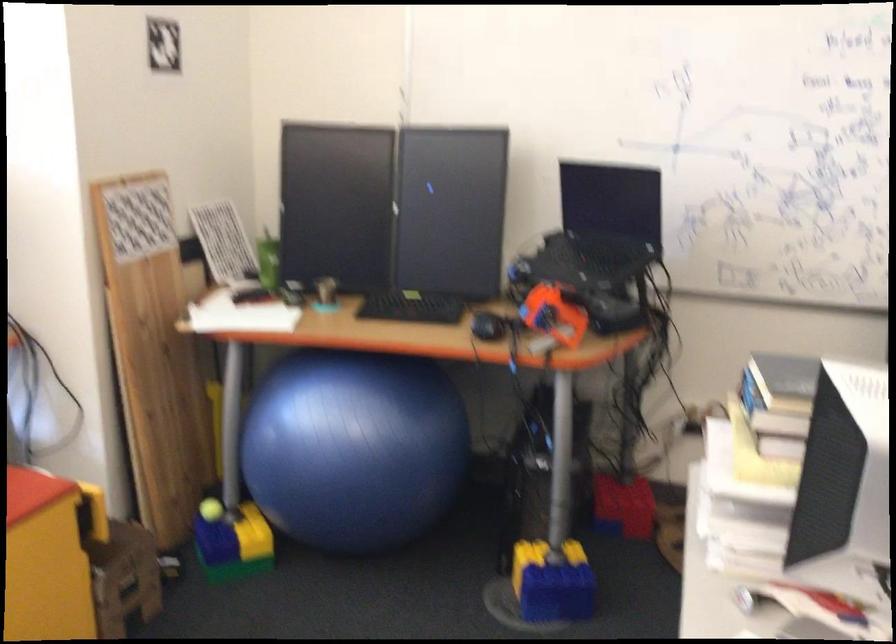
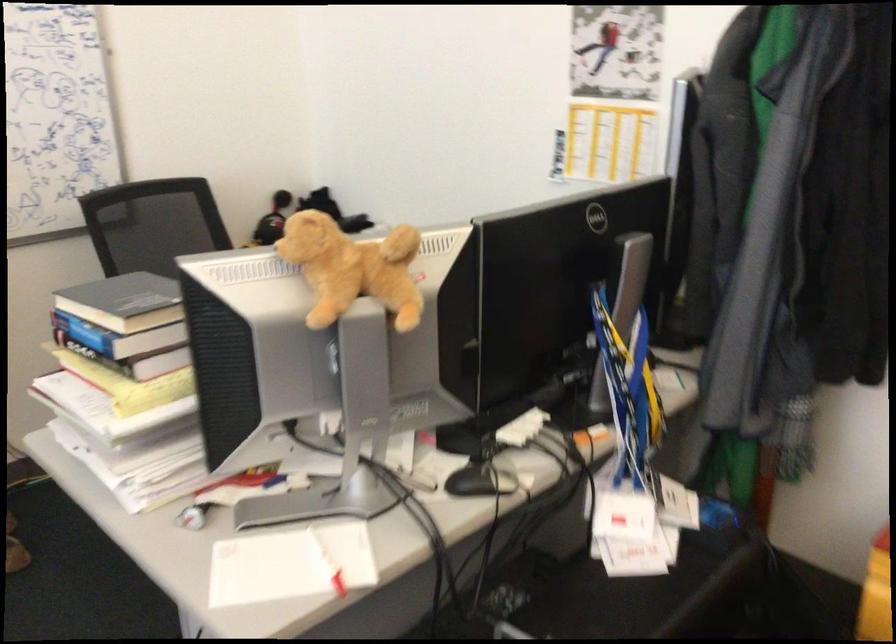
Question: The camera is either moving clockwise (left) or counter-clockwise (right) around the object. The first image is from the beginning of the video and the second image is from the end. Is the camera moving left or right when shooting the video?

Choices:
 (A) Left
 (B) Right

Answer: (A)